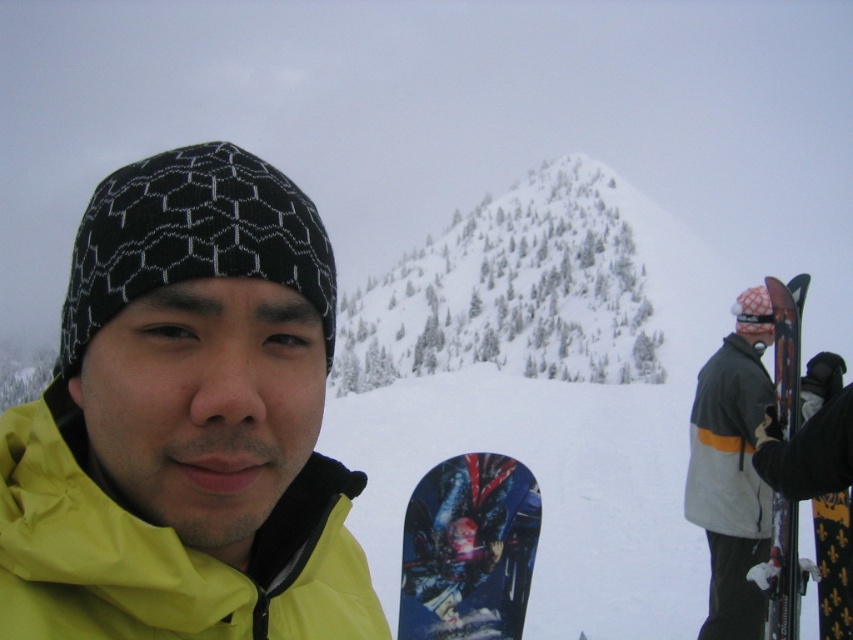
Based on the photo, who is taller, gray woolen jacket at right or gray fleece jacket at right?

gray woolen jacket at right is taller.

Who is higher up, gray woolen jacket at right or gray fleece jacket at right?

gray woolen jacket at right

Which is behind, point (712, 564) or point (700, 490)?

Point (712, 564)

Locate an element on the screen. Image resolution: width=853 pixels, height=640 pixels. gray woolen jacket at right is located at coordinates (732, 468).

Does yellow matte jacket at lower left appear under shiny blue snowboard at center?

Incorrect, yellow matte jacket at lower left is not positioned below shiny blue snowboard at center.

Is point (90, 481) in front of point (405, 568)?

Yes, point (90, 481) is in front of point (405, 568).

At what (x,y) coordinates should I click in order to perform the action: click on yellow matte jacket at lower left. Please return your answer as a coordinate pair (x, y). The height and width of the screenshot is (640, 853). Looking at the image, I should click on (165, 552).

How much distance is there between shiny blue snowboard at center and gray woolen jacket at right?

shiny blue snowboard at center and gray woolen jacket at right are 3.00 meters apart from each other.

Find the location of a particular element. shiny blue snowboard at center is located at coordinates (468, 548).